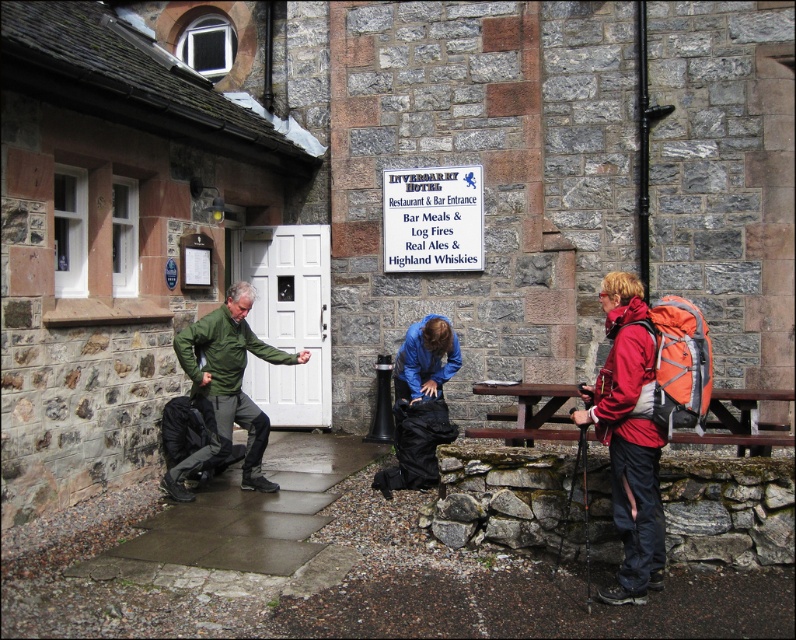
Who is more forward, (387, 232) or (568, 387)?

Point (568, 387)

Looking at this image, which is above, white plastic sign at upper center or brown wooden picnic table at center?

white plastic sign at upper center

Identify the location of white plastic sign at upper center. The image size is (796, 640). click(432, 218).

Identify the location of white plastic sign at upper center. (432, 218).

Does matte red jacket at right have a lesser width compared to brown wooden picnic table at center?

Yes, matte red jacket at right is thinner than brown wooden picnic table at center.

In the scene shown: How much distance is there between matte red jacket at right and brown wooden picnic table at center?

matte red jacket at right is 24.28 inches from brown wooden picnic table at center.

Image resolution: width=796 pixels, height=640 pixels. Find the location of `matte red jacket at right`. matte red jacket at right is located at coordinates (627, 440).

Can you confirm if green matte jacket at center is bigger than white plastic sign at upper center?

Yes.

Does green matte jacket at center appear on the left side of white plastic sign at upper center?

Correct, you'll find green matte jacket at center to the left of white plastic sign at upper center.

Where is `green matte jacket at center`? green matte jacket at center is located at coordinates (225, 388).

The image size is (796, 640). What are the coordinates of `green matte jacket at center` in the screenshot? It's located at (225, 388).